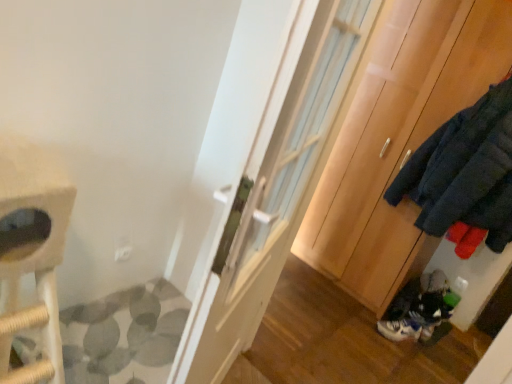
This screenshot has height=384, width=512. Describe the element at coordinates (398, 139) in the screenshot. I see `wooden cabinet at right` at that location.

This screenshot has width=512, height=384. Describe the element at coordinates (399, 329) in the screenshot. I see `white leather sneaker at lower right` at that location.

I want to click on white leather sneaker at lower right, so click(x=399, y=329).

Identify the location of white glossy door at center. (275, 184).

Is wooden cabinet at right next to white glossy door at center?

No, wooden cabinet at right is not touching white glossy door at center.

Does wooden cabinet at right have a greater width compared to white glossy door at center?

Yes.

Consider the image. Does wooden cabinet at right have a smaller size compared to white glossy door at center?

No, wooden cabinet at right is not smaller than white glossy door at center.

Is wooden cabinet at right to the left of white leather sneaker at lower right from the viewer's perspective?

No, wooden cabinet at right is not to the left of white leather sneaker at lower right.

Locate an element on the screen. The image size is (512, 384). cabinetry in front of the white leather sneaker at lower right is located at coordinates (398, 139).

Is white leather sneaker at lower right a part of wooden cabinet at right?

No, white leather sneaker at lower right is not a part of wooden cabinet at right.

From the image's perspective, which one is positioned higher, wooden cabinet at right or white leather sneaker at lower right?

wooden cabinet at right is shown above in the image.

Considering the relative sizes of white glossy door at center and wooden cabinet at right in the image provided, is white glossy door at center wider than wooden cabinet at right?

No.

From their relative heights in the image, would you say white glossy door at center is taller or shorter than wooden cabinet at right?

Considering their sizes, white glossy door at center has less height than wooden cabinet at right.

Is white glossy door at center positioned far away from wooden cabinet at right?

Absolutely, white glossy door at center is distant from wooden cabinet at right.

Considering their positions, is white glossy door at center located in front of or behind wooden cabinet at right?

white glossy door at center is positioned closer to the viewer than wooden cabinet at right.

Does white glossy door at center have a lesser height compared to white leather sneaker at lower right?

No.

Would you consider white glossy door at center to be distant from white leather sneaker at lower right?

Indeed, white glossy door at center is not near white leather sneaker at lower right.

Is white glossy door at center thinner than white leather sneaker at lower right?

No.

Would you say white glossy door at center is to the left or to the right of white leather sneaker at lower right in the picture?

In the image, white glossy door at center appears on the left side of white leather sneaker at lower right.

Does white leather sneaker at lower right touch wooden cabinet at right?

No.

From a real-world perspective, who is located lower, white leather sneaker at lower right or wooden cabinet at right?

white leather sneaker at lower right is physically lower.

Which is closer, (390, 338) or (504, 48)?

Point (390, 338) is positioned farther from the camera compared to point (504, 48).

Is white leather sneaker at lower right at the left side of wooden cabinet at right?

Yes, white leather sneaker at lower right is to the left of wooden cabinet at right.

This screenshot has width=512, height=384. In order to click on door in front of the white leather sneaker at lower right in this screenshot , I will do `click(275, 184)`.

Is white leather sneaker at lower right completely or partially outside of white glossy door at center?

Yes, white leather sneaker at lower right is located beyond the bounds of white glossy door at center.

How much distance is there between white leather sneaker at lower right and white glossy door at center?

white leather sneaker at lower right and white glossy door at center are 5.00 feet apart.

Which object is positioned more to the left, white leather sneaker at lower right or white glossy door at center?

white glossy door at center is more to the left.

Image resolution: width=512 pixels, height=384 pixels. Find the location of `cabinetry on the right of the white glossy door at center`. cabinetry on the right of the white glossy door at center is located at coordinates (398, 139).

Locate an element on the screen. This screenshot has height=384, width=512. cabinetry in front of the white leather sneaker at lower right is located at coordinates (398, 139).

Which object lies further to the anchor point white leather sneaker at lower right, white glossy door at center or wooden cabinet at right?

Based on the image, white glossy door at center appears to be further to white leather sneaker at lower right.

Based on their spatial positions, is white glossy door at center or white leather sneaker at lower right further from wooden cabinet at right?

white glossy door at center is positioned further to the anchor wooden cabinet at right.

Considering their positions, is white leather sneaker at lower right positioned closer to white glossy door at center than wooden cabinet at right?

wooden cabinet at right.

Which object lies further to the anchor point white leather sneaker at lower right, wooden cabinet at right or white glossy door at center?

white glossy door at center lies further to white leather sneaker at lower right than the other object.

Estimate the real-world distances between objects in this image. Which object is closer to wooden cabinet at right, white leather sneaker at lower right or white glossy door at center?

The object closer to wooden cabinet at right is white leather sneaker at lower right.

From the image, which object appears to be farther from white glossy door at center, wooden cabinet at right or white leather sneaker at lower right?

white leather sneaker at lower right.

The image size is (512, 384). I want to click on cabinetry located between white glossy door at center and white leather sneaker at lower right in the depth direction, so click(398, 139).